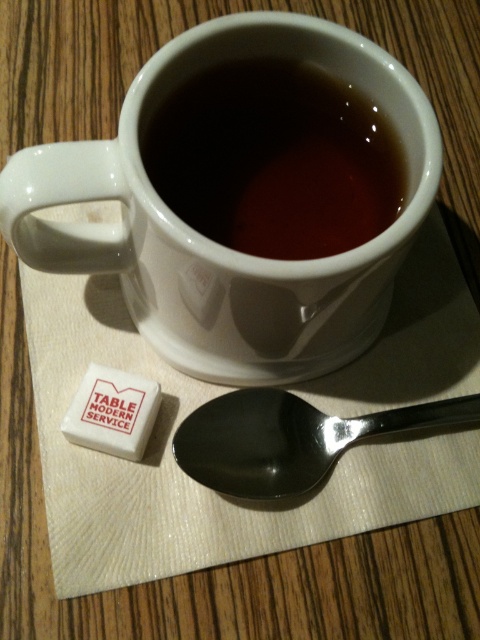
Looking at this image, you are a barista arranging items on a table. You need to place a new item between the white ceramic mug at upper center and the polished metal spoon at lower center. Based on their positions, where should you place the new item to ensure it is equidistant from both objects?

The white ceramic mug at upper center is closer to the viewer than the polished metal spoon at lower center. To place the new item equidistant from both, it should be positioned closer to the spoon since the mug is nearer, balancing the distance in three dimensions.

You are setting up a table for a guest and need to place a coaster under the matte ceramic mug at upper center. The coaster you have is exactly the size of the polished metal spoon at lower center. Will the coaster fit under the mug?

The matte ceramic mug at upper center is positioned over the polished metal spoon at lower center, so the coaster, which is the same size as the spoon, will be smaller than the mug and may not fully cover the table underneath.

You are setting up a table for a guest and need to place a coaster under the matte ceramic mug at upper center. The coaster is currently under the polished metal spoon at lower center. Can you move the coaster to the correct position without moving the spoon?

The matte ceramic mug at upper center is to the left of polished metal spoon at lower center. Since the coaster is under the spoon, moving it to the mug would require sliding it left, but the spoon is in the way. Therefore, you need to lift the spoon first before moving the coaster to the mug.